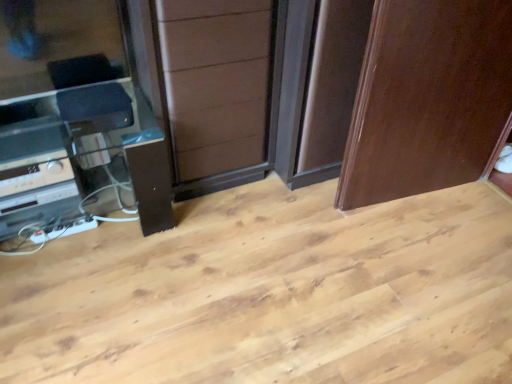
Locate an element on the screen. vacant area that is in front of brown wood screen door at center is located at coordinates (223, 236).